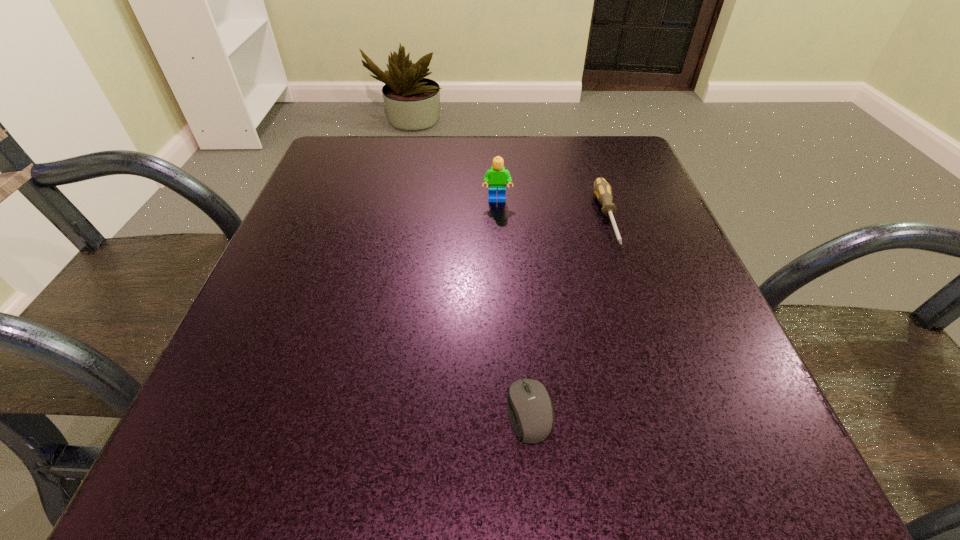
You are a GUI agent. You are given a task and a screenshot of the screen. Output one action in this format:
    pyautogui.click(x=<x>, y=<y>)
    Task: Click on the object that is at the right edge
    The width and height of the screenshot is (960, 540).
    Given the screenshot: What is the action you would take?
    pyautogui.click(x=602, y=190)

Identify the location of object present at the far right corner. The height and width of the screenshot is (540, 960). (602, 190).

Image resolution: width=960 pixels, height=540 pixels. In the image, there is a desktop. What are the coordinates of `vacant space at the far edge` in the screenshot? It's located at (395, 151).

The image size is (960, 540). In the image, there is a desktop. In order to click on vacant space at the near edge in this screenshot , I will do `click(380, 448)`.

The width and height of the screenshot is (960, 540). In the image, there is a desktop. Find the location of `vacant space at the left edge`. vacant space at the left edge is located at coordinates (274, 258).

The height and width of the screenshot is (540, 960). What are the coordinates of `blank space at the right edge` in the screenshot? It's located at (710, 389).

I want to click on free space at the far left corner of the desktop, so click(379, 163).

This screenshot has height=540, width=960. Identify the location of free space at the near left corner of the desktop. (246, 476).

The width and height of the screenshot is (960, 540). In the image, there is a desktop. What are the coordinates of `vacant space at the near right corner` in the screenshot? It's located at (774, 495).

You are a GUI agent. You are given a task and a screenshot of the screen. Output one action in this format:
    pyautogui.click(x=<x>, y=<y>)
    Task: Click on the vacant area that lies between the Lego and the shortest object
    The width and height of the screenshot is (960, 540).
    Given the screenshot: What is the action you would take?
    pyautogui.click(x=514, y=306)